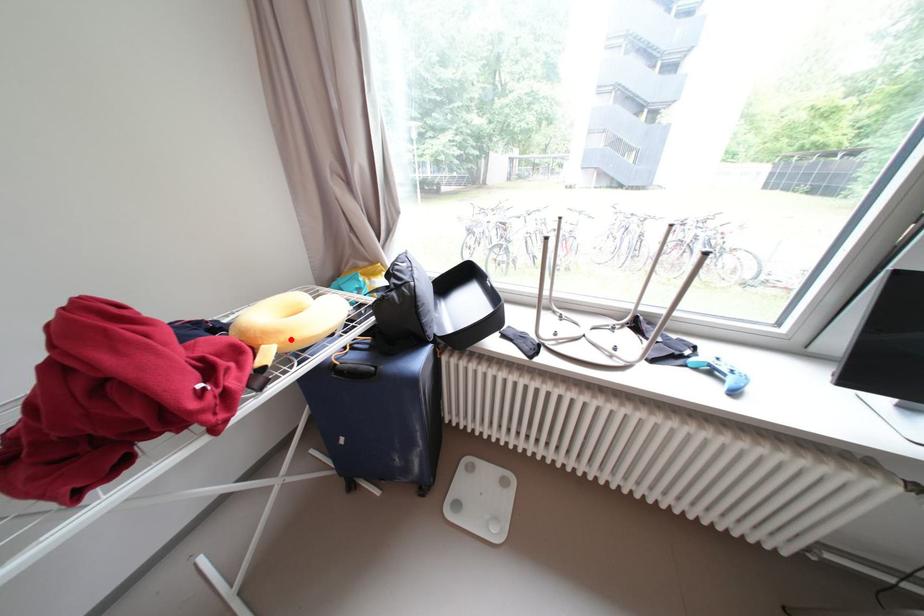
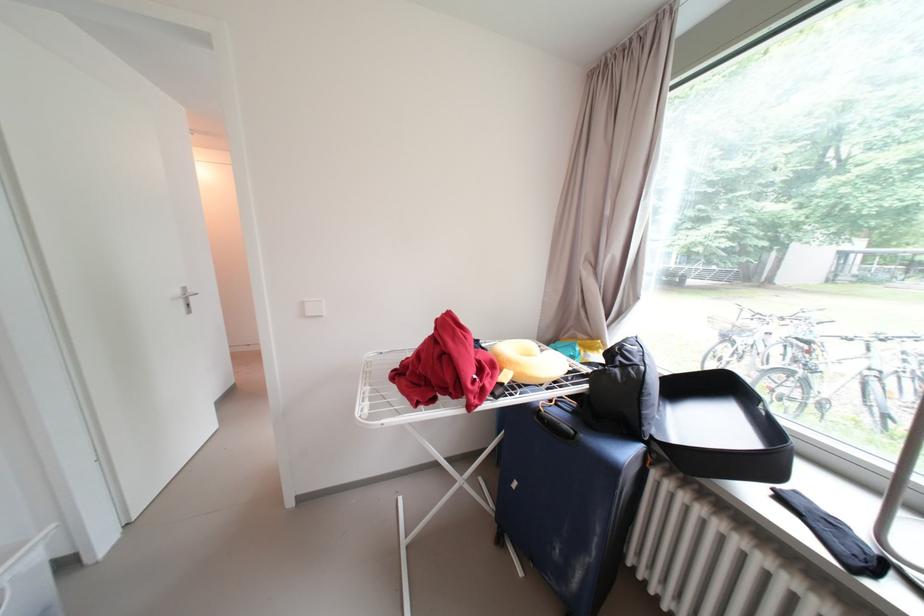
Question: I am providing you with two images of the same scene from different viewpoints. A red point is marked on the first image. Can you still see the location of the red point in image 2?

Choices:
 (A) Yes
 (B) No

Answer: (A)